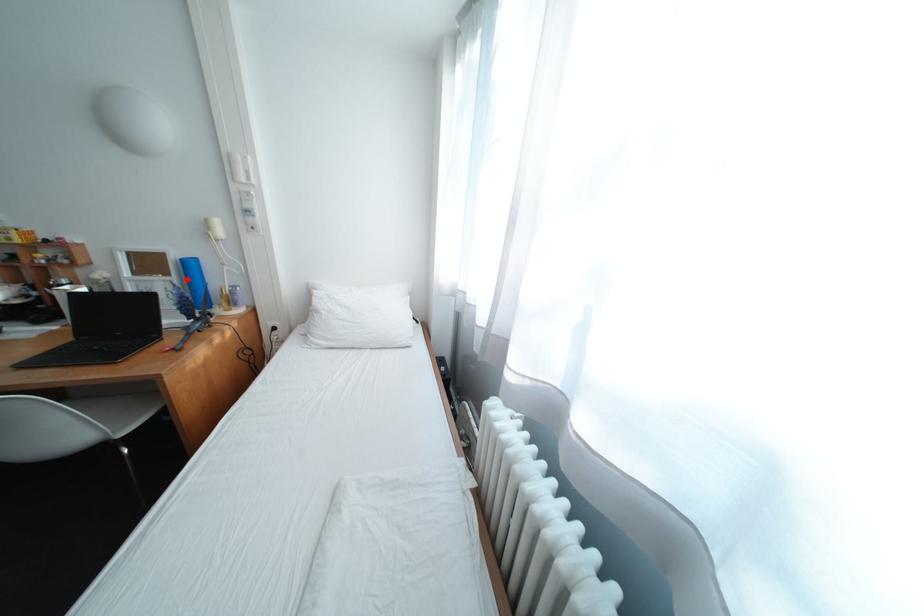
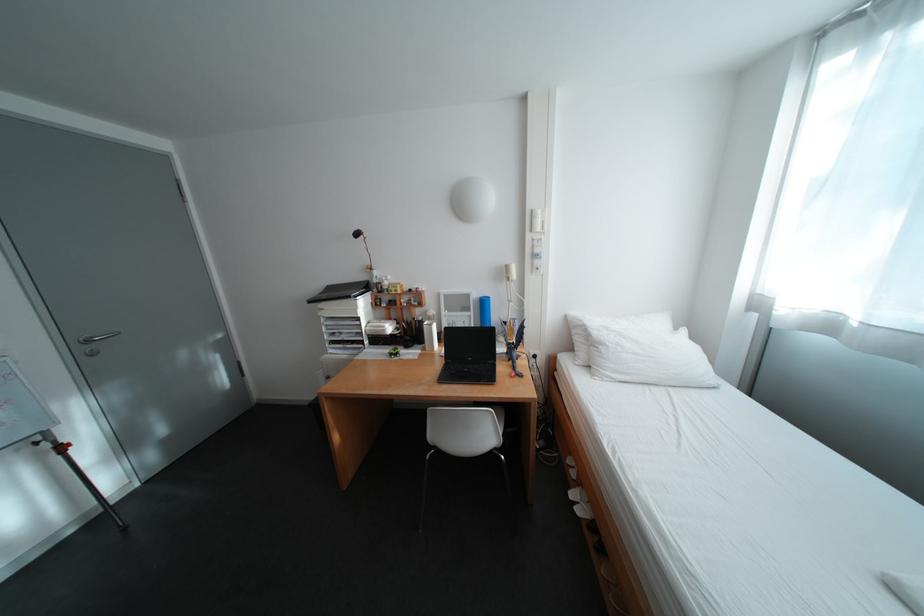
Locate, in the second image, the point that corresponds to the highlighted location in the first image.

(484, 314)